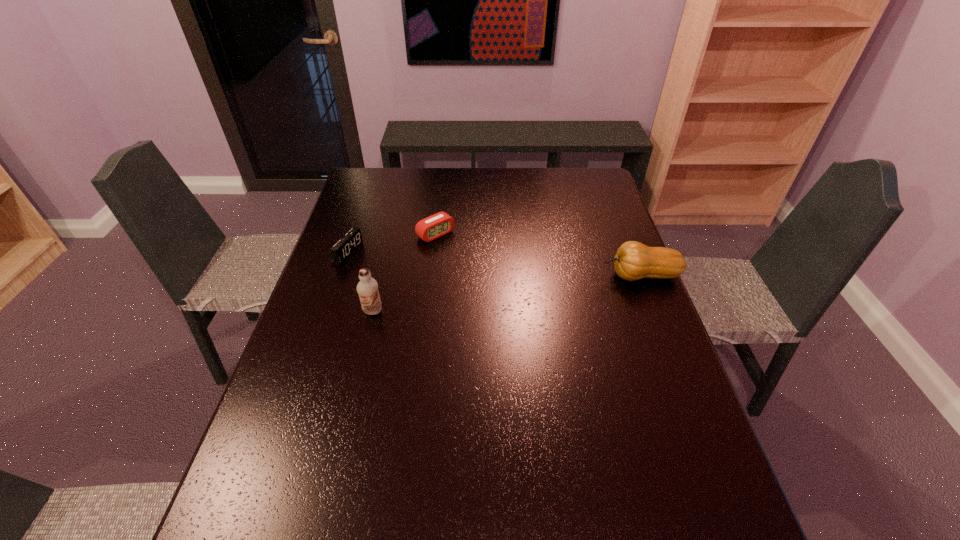
This screenshot has width=960, height=540. Identify the location of vacant space on the desktop that is between the chocolate milk and the rightmost object and is positioned on the front-facing side of the third object from left to right. (506, 294).

I want to click on free space on the desktop that is between the chocolate milk and the second tallest object and is positioned on the front-facing side of the leftmost object, so click(490, 295).